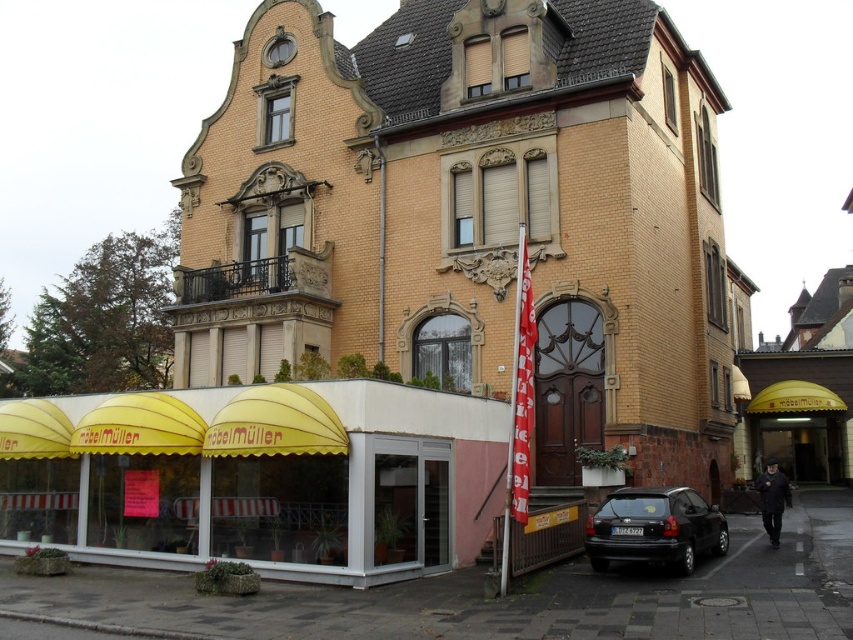
You are standing in front of the yellow brick building at center and want to walk to the yellow fabric awning at lower left. Which direction should you move to get closer to the awning?

Since the yellow brick building at center is closer to you than the yellow fabric awning at lower left, you should move forward towards the awning to get closer to it.

You are a delivery person trying to park your 1.8 meters tall delivery cart in front of the building. The parking spot is between the black matte hatchback at lower right and the yellow fabric canopy at center. Can your cart fit vertically between them?

The black matte hatchback at lower right is taller than the yellow fabric canopy at center. Since your cart is 1.8 meters tall, you need to check the vertical clearance. However, the description only provides a comparison between the two objects, not their exact heights. Without knowing the exact height of the lower object, it is uncertain if the cart can fit. Please measure the space before parking.

You are standing in front of the building and see the black matte hatchback at lower right and the yellow fabric canopy at center. Which object is positioned to the left of the other?

The black matte hatchback at lower right is to the left of the yellow fabric canopy at center.